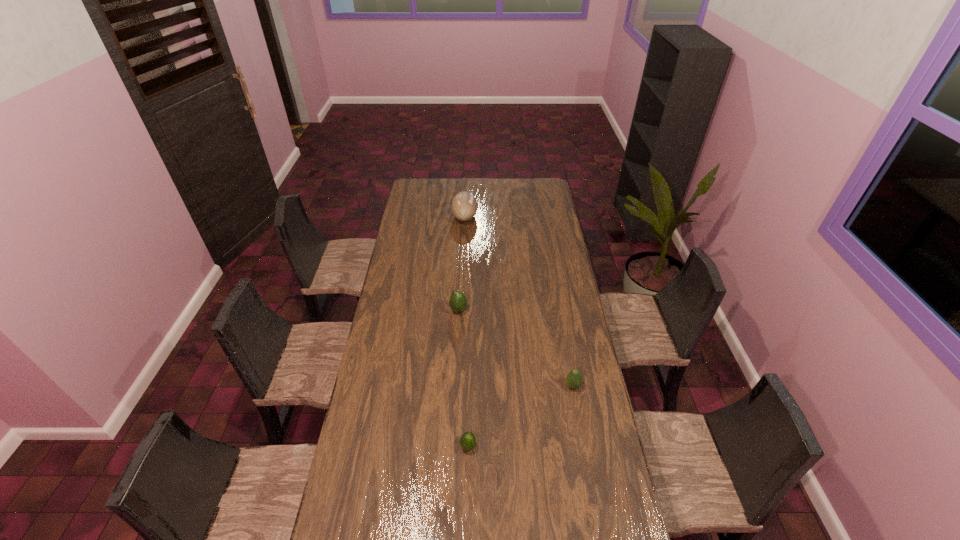
Image resolution: width=960 pixels, height=540 pixels. In order to click on vacant space that satisfies the following two spatial constraints: 1. on the laces of the football (American); 2. on the right side of the rightmost avocado in this screenshot , I will do `click(457, 386)`.

You are a GUI agent. You are given a task and a screenshot of the screen. Output one action in this format:
    pyautogui.click(x=<x>, y=<y>)
    Task: Click on the free region that satisfies the following two spatial constraints: 1. on the laces of the second nearest avocado; 2. on the left side of the tallest object
    This screenshot has width=960, height=540.
    Given the screenshot: What is the action you would take?
    pyautogui.click(x=457, y=386)

Image resolution: width=960 pixels, height=540 pixels. I want to click on blank space that satisfies the following two spatial constraints: 1. on the laces of the football (American); 2. on the right side of the rightmost avocado, so click(457, 386).

Find the location of a particular element. Image resolution: width=960 pixels, height=540 pixels. free space that satisfies the following two spatial constraints: 1. on the front side of the second tallest object; 2. on the right side of the nearest avocado is located at coordinates (452, 446).

Identify the location of vacant position in the image that satisfies the following two spatial constraints: 1. on the front side of the farthest avocado; 2. on the right side of the rightmost object. (455, 386).

The image size is (960, 540). Find the location of `free space that satisfies the following two spatial constraints: 1. on the back side of the rightmost object; 2. on the right side of the nearest object`. free space that satisfies the following two spatial constraints: 1. on the back side of the rightmost object; 2. on the right side of the nearest object is located at coordinates (469, 386).

Locate an element on the screen. Image resolution: width=960 pixels, height=540 pixels. free location that satisfies the following two spatial constraints: 1. on the laces of the second nearest object; 2. on the right side of the tallest object is located at coordinates (457, 386).